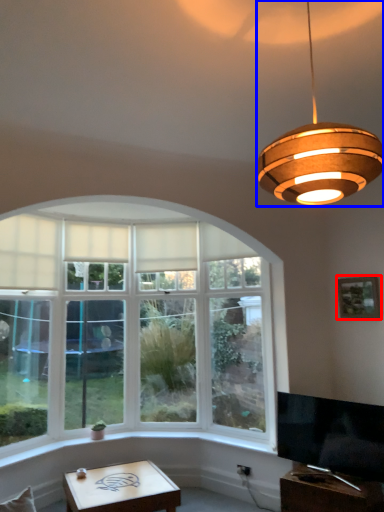
Question: Which of the following is the farthest to the observer, picture frame (highlighted by a red box) or lamp (highlighted by a blue box)?

Choices:
 (A) picture frame
 (B) lamp

Answer: (A)